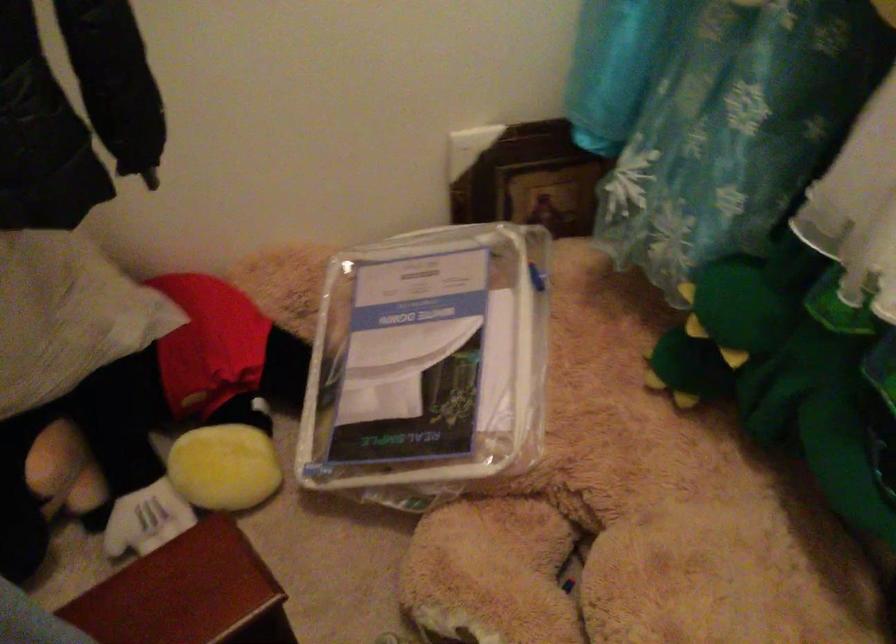
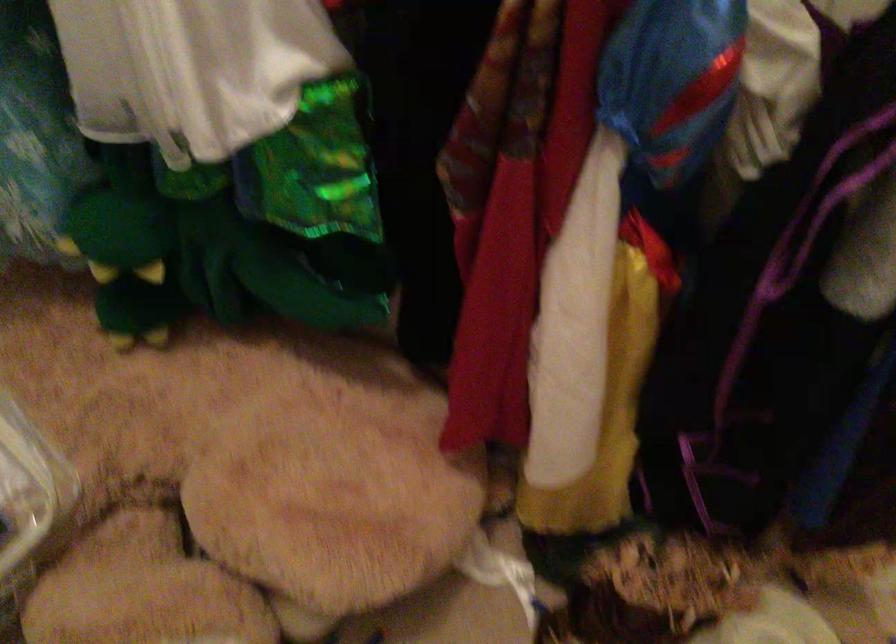
Question: The images are taken continuously from a first-person perspective. In which direction is your viewpoint rotating?

Choices:
 (A) Left
 (B) Right
 (C) Up
 (D) Down

Answer: (B)